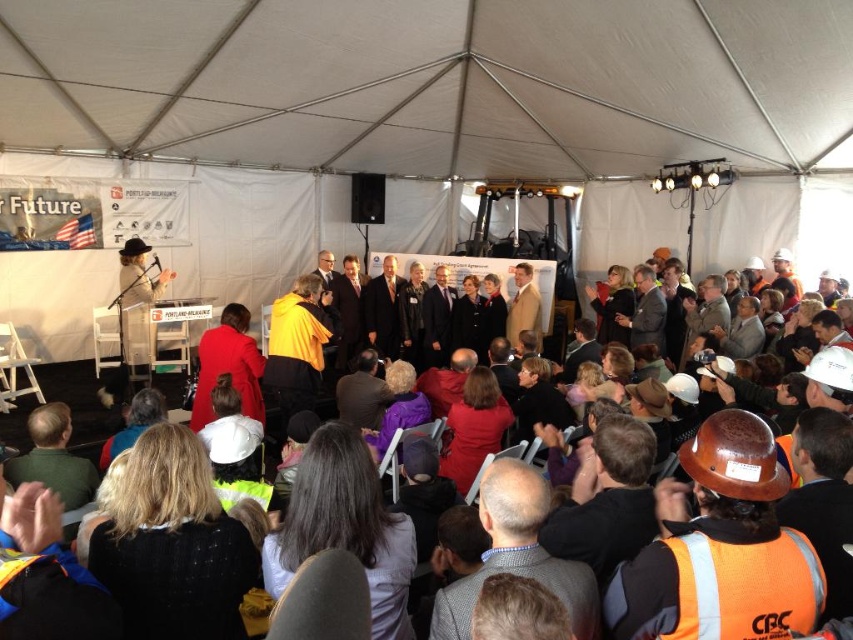
Describe the element at coordinates (172, 545) in the screenshot. Image resolution: width=853 pixels, height=640 pixels. I see `black knit sweater at lower left` at that location.

Does black knit sweater at lower left have a greater height compared to hard hat at left?

No, black knit sweater at lower left is not taller than hard hat at left.

Who is more distant from viewer, (135, 509) or (160, 289)?

Point (160, 289)

Find the location of a particular element. black knit sweater at lower left is located at coordinates (172, 545).

Who is positioned more to the right, hard hat at left or light brown leather jacket at center?

light brown leather jacket at center

Where is `hard hat at left`? Image resolution: width=853 pixels, height=640 pixels. hard hat at left is located at coordinates (137, 305).

Is green fabric jacket at lower left to the right of light brown leather jacket at center from the viewer's perspective?

Incorrect, green fabric jacket at lower left is not on the right side of light brown leather jacket at center.

Is green fabric jacket at lower left wider than light brown leather jacket at center?

Correct, the width of green fabric jacket at lower left exceeds that of light brown leather jacket at center.

What do you see at coordinates (53, 458) in the screenshot? I see `green fabric jacket at lower left` at bounding box center [53, 458].

Image resolution: width=853 pixels, height=640 pixels. I want to click on green fabric jacket at lower left, so click(53, 458).